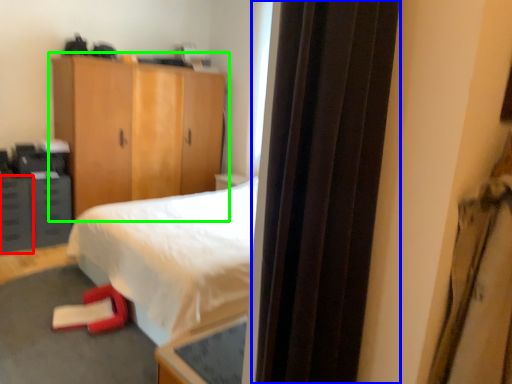
Question: Which object is the farthest from drawer (highlighted by a red box)? Choose among these: screen door (highlighted by a blue box) or cupboard (highlighted by a green box).

Choices:
 (A) screen door
 (B) cupboard

Answer: (A)